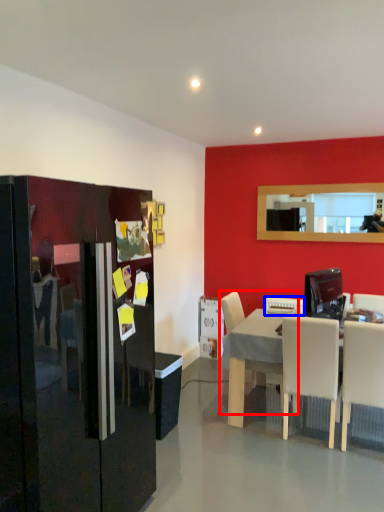
Question: Which object appears farthest to the camera in this image, chair (highlighted by a red box) or appliance (highlighted by a blue box)?

Choices:
 (A) chair
 (B) appliance

Answer: (B)